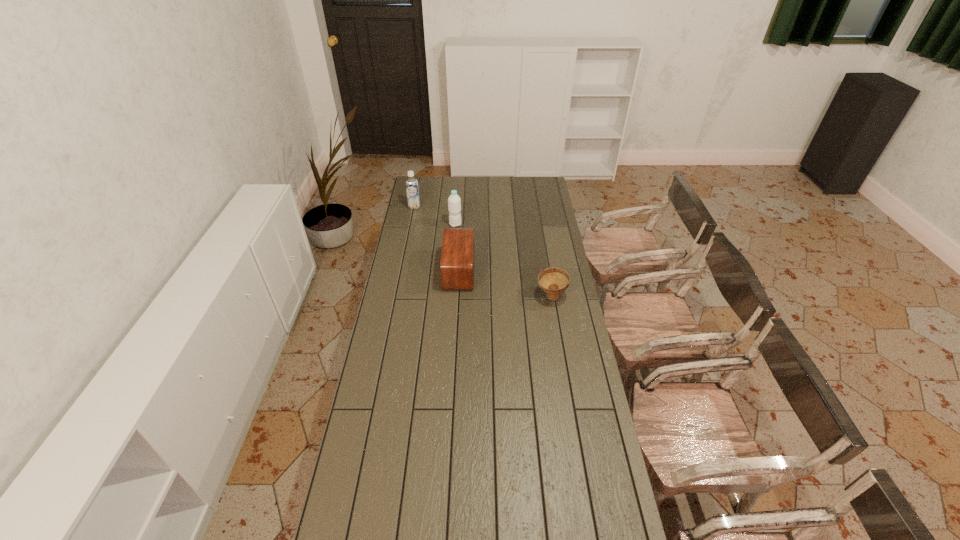
Image resolution: width=960 pixels, height=540 pixels. Find the location of `object present at the left edge`. object present at the left edge is located at coordinates (412, 189).

Locate an element on the screen. This screenshot has height=540, width=960. object situated at the right edge is located at coordinates (553, 281).

In the image, there is a desktop. Identify the location of free region at the far edge. The image size is (960, 540). (499, 179).

What are the coordinates of `free space at the left edge of the desktop` in the screenshot? It's located at (430, 220).

In the image, there is a desktop. Where is `vacant space at the right edge`? The width and height of the screenshot is (960, 540). vacant space at the right edge is located at coordinates (589, 372).

In the image, there is a desktop. Identify the location of free region at the far right corner. The image size is (960, 540). (535, 183).

At what (x,y) coordinates should I click in order to perform the action: click on free space between the second farthest object and the farthest object. Please return your answer as a coordinate pair (x, y). Looking at the image, I should click on (435, 215).

This screenshot has height=540, width=960. Identify the location of unoccupied area between the third nearest object and the farthest object. (435, 215).

The width and height of the screenshot is (960, 540). I want to click on free point between the second shortest object and the rightmost object, so click(x=505, y=284).

Where is `free space between the water bottle and the soup bowl`? This screenshot has width=960, height=540. free space between the water bottle and the soup bowl is located at coordinates (503, 261).